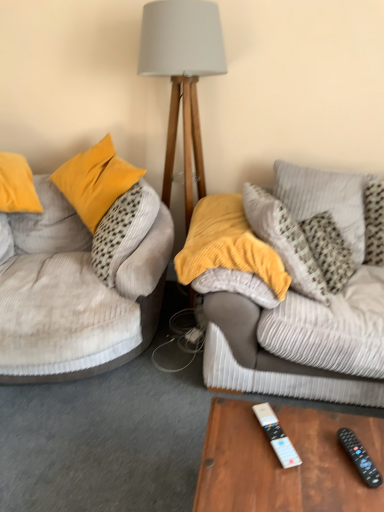
Locate an element on the screen. Image resolution: width=384 pixels, height=512 pixels. free space above wooden table at lower center (from a real-world perspective) is located at coordinates (300, 459).